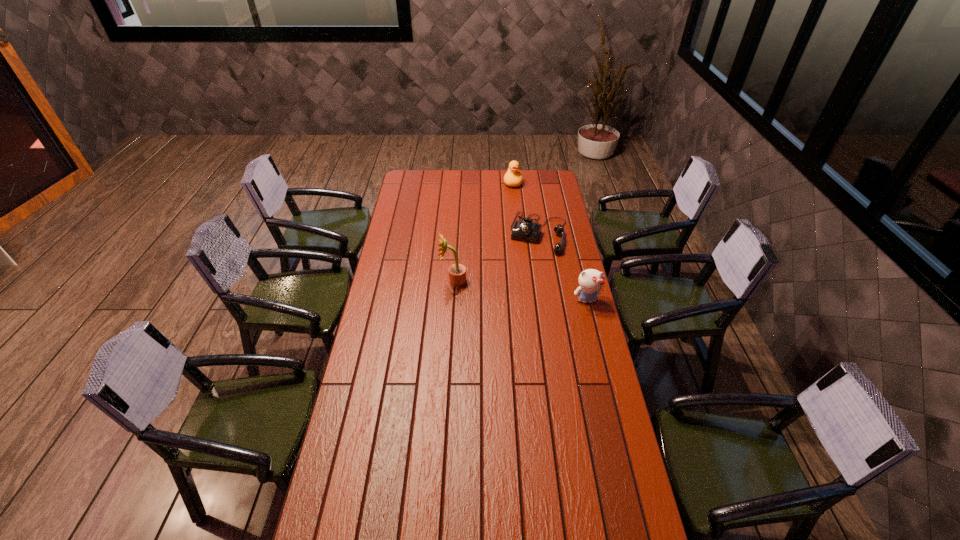
This screenshot has width=960, height=540. What are the coordinates of `telephone located in the right edge section of the desktop` in the screenshot? It's located at (527, 230).

This screenshot has width=960, height=540. What are the coordinates of `free point at the left edge` in the screenshot? It's located at (381, 288).

Where is `free space at the right edge`? free space at the right edge is located at coordinates (582, 415).

In the image, there is a desktop. Identify the location of free space at the far left corner. tap(421, 172).

You are a GUI agent. You are given a task and a screenshot of the screen. Output one action in this format:
    pyautogui.click(x=<x>, y=<y>)
    Task: Click on the empty space that is in between the farthest object and the second nearest object
    
    Given the screenshot: What is the action you would take?
    pyautogui.click(x=484, y=232)

Locate an element on the screen. The height and width of the screenshot is (540, 960). free spot between the farthest object and the shortest object is located at coordinates (526, 207).

Image resolution: width=960 pixels, height=540 pixels. I want to click on free spot between the second shortest object and the tallest object, so click(x=484, y=232).

Where is `vacant region between the nearest object and the third nearest object`? vacant region between the nearest object and the third nearest object is located at coordinates (563, 266).

Locate an element on the screen. The height and width of the screenshot is (540, 960). vacant area that lies between the leftmost object and the third shortest object is located at coordinates [520, 291].

This screenshot has width=960, height=540. Identify the location of empty location between the duck and the kitten. (550, 241).